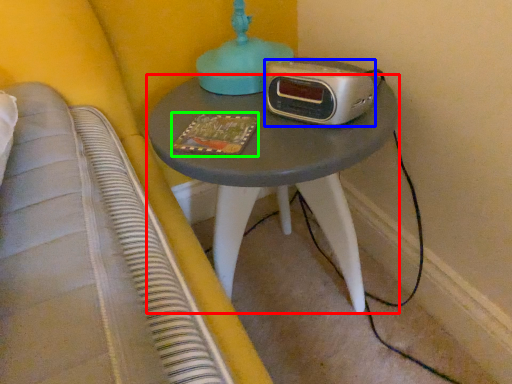
Question: Based on their relative distances, which object is farther from nightstand (highlighted by a red box)? Choose from stereo (highlighted by a blue box) and book (highlighted by a green box).

Choices:
 (A) stereo
 (B) book

Answer: (B)